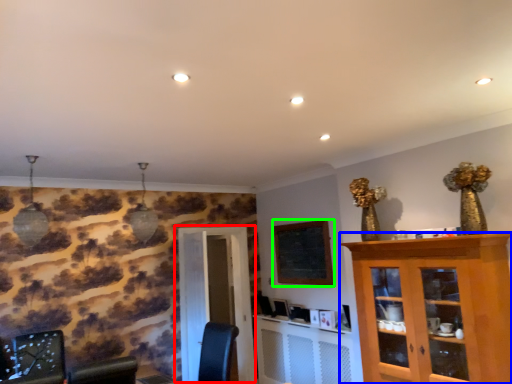
Question: Estimate the real-world distances between objects in this image. Which object is closer to door (highlighted by a red box), cabinetry (highlighted by a blue box) or bulletin board (highlighted by a green box)?

Choices:
 (A) cabinetry
 (B) bulletin board

Answer: (B)